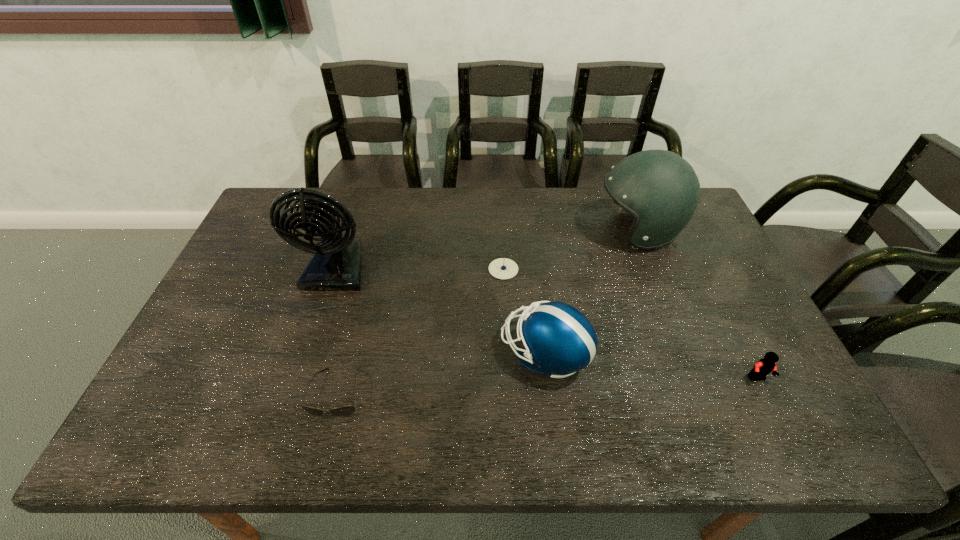
You are a GUI agent. You are given a task and a screenshot of the screen. Output one action in this format:
    pyautogui.click(x=<x>, y=<y>)
    Task: Click on the vacant space located 0.330m at the face opening of the taller football helmet
    This screenshot has width=960, height=540.
    Given the screenshot: What is the action you would take?
    pyautogui.click(x=494, y=231)

This screenshot has height=540, width=960. Find the location of `free space located 0.150m at the face opening of the taller football helmet`. free space located 0.150m at the face opening of the taller football helmet is located at coordinates (548, 231).

Image resolution: width=960 pixels, height=540 pixels. I want to click on vacant area located at the front of the left football helmet with the faceguard, so click(372, 353).

Locate an element on the screen. free location located at the front of the left football helmet with the faceguard is located at coordinates (466, 353).

What are the coordinates of `vacant space situated 0.130m at the front of the left football helmet with the faceguard` in the screenshot? It's located at (450, 353).

This screenshot has height=540, width=960. I want to click on vacant space situated on the front-facing side of the Lego, so click(x=771, y=405).

In order to click on free space located on the front of the compass in this screenshot , I will do 508,347.

This screenshot has width=960, height=540. Find the location of `object that is at the far edge`. object that is at the far edge is located at coordinates (661, 190).

Locate an element on the screen. This screenshot has height=540, width=960. object situated at the near edge is located at coordinates (343, 411).

This screenshot has height=540, width=960. Find the location of `football helmet that is positioned at the right edge`. football helmet that is positioned at the right edge is located at coordinates (661, 190).